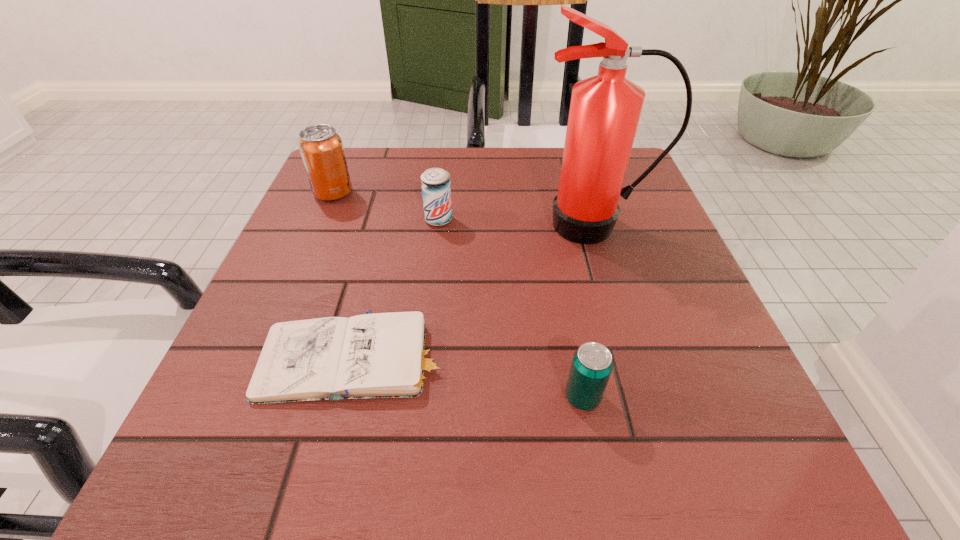
Find the location of a particular element. the third closest object to the fire extinguisher is located at coordinates (592, 364).

Locate which object is the second closest to the farther beer can. Please provide its 2D coordinates. Your answer should be formatted as a tuple, i.e. [(x, y)], where the tuple contains the x and y coordinates of a point satisfying the conditions above.

[(321, 148)]

Where is `vacant region that satisfies the following two spatial constraints: 1. on the front side of the notebook; 2. on the left side of the soda can`? Image resolution: width=960 pixels, height=540 pixels. vacant region that satisfies the following two spatial constraints: 1. on the front side of the notebook; 2. on the left side of the soda can is located at coordinates 264,355.

The width and height of the screenshot is (960, 540). Identify the location of free space that satisfies the following two spatial constraints: 1. on the back side of the farther beer can; 2. on the right side of the notebook. (390, 220).